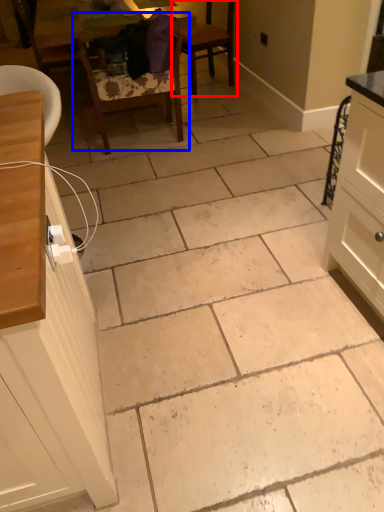
Question: Which object is further to the camera taking this photo, chair (highlighted by a red box) or chair (highlighted by a blue box)?

Choices:
 (A) chair
 (B) chair

Answer: (A)